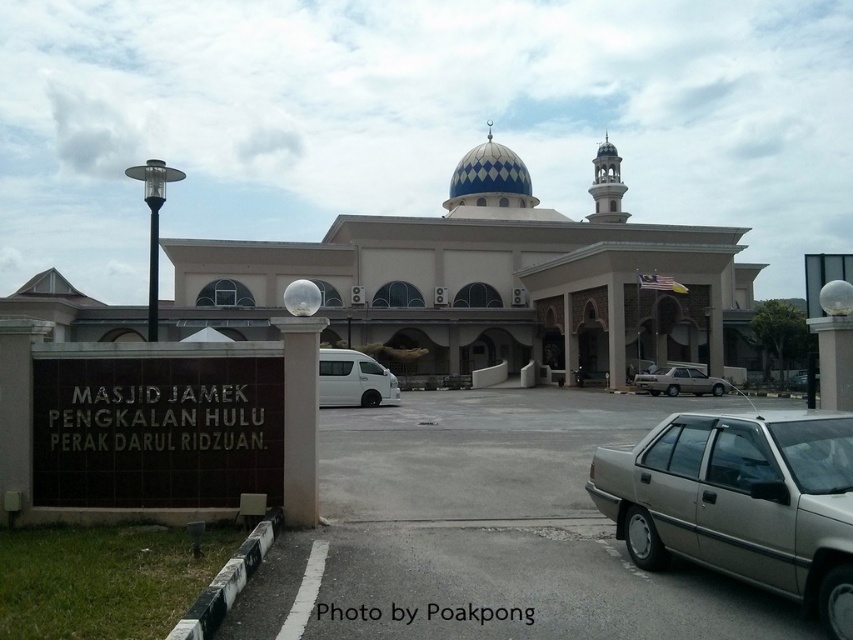
Can you confirm if white matte van at center is thinner than satin beige sedan at lower right?

No.

Which is in front, point (335, 355) or point (659, 369)?

Positioned in front is point (335, 355).

You are a GUI agent. You are given a task and a screenshot of the screen. Output one action in this format:
    pyautogui.click(x=<x>, y=<y>)
    Task: Click on the white matte van at center
    The height and width of the screenshot is (640, 853).
    Given the screenshot: What is the action you would take?
    pyautogui.click(x=352, y=380)

Is gray asphalt parking lot at center bigger than metallic silver sedan at lower right?

Correct, gray asphalt parking lot at center is larger in size than metallic silver sedan at lower right.

The image size is (853, 640). Identify the location of gray asphalt parking lot at center. (490, 531).

Image resolution: width=853 pixels, height=640 pixels. Identify the location of gray asphalt parking lot at center. (490, 531).

Where is `gray asphalt parking lot at center`? This screenshot has height=640, width=853. gray asphalt parking lot at center is located at coordinates (490, 531).

Based on the photo, between metallic silver sedan at lower right and satin beige sedan at lower right, which one is positioned lower?

satin beige sedan at lower right is lower down.

Is point (738, 458) positioned in front of point (670, 371)?

Yes.

Describe the element at coordinates (741, 500) in the screenshot. This screenshot has height=640, width=853. I see `metallic silver sedan at lower right` at that location.

Where is `metallic silver sedan at lower right`? metallic silver sedan at lower right is located at coordinates (741, 500).